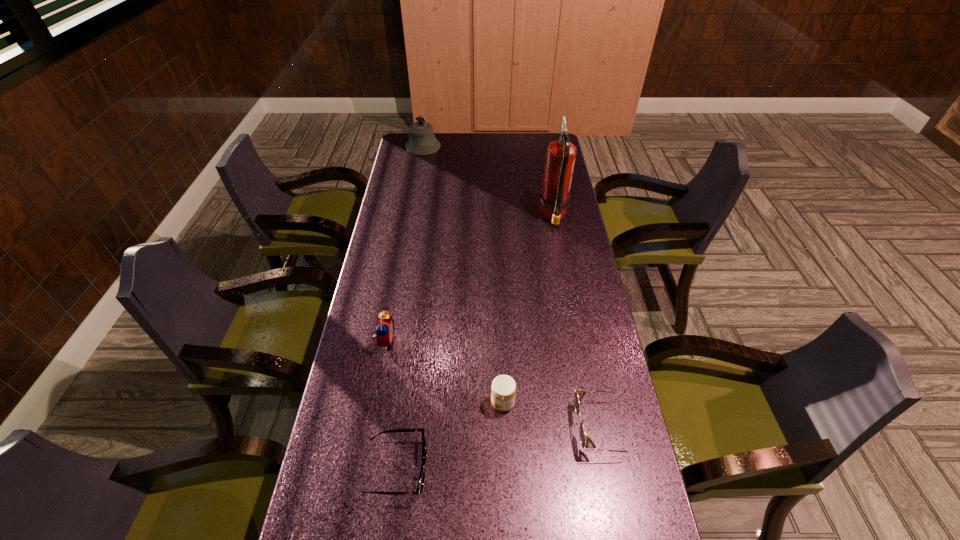
Where is `the tallest object`? The image size is (960, 540). the tallest object is located at coordinates (560, 155).

At what (x,y) coordinates should I click in order to perform the action: click on the second farthest object. Please return your answer as a coordinate pair (x, y). The image size is (960, 540). Looking at the image, I should click on pyautogui.click(x=560, y=155).

Locate an element on the screen. This screenshot has width=960, height=540. the fifth shortest object is located at coordinates (422, 141).

This screenshot has width=960, height=540. What are the coordinates of `bell` in the screenshot? It's located at (422, 141).

At what (x,y) coordinates should I click in order to perform the action: click on alarm clock. Please return your answer as a coordinate pair (x, y). The width and height of the screenshot is (960, 540). Looking at the image, I should click on (385, 329).

Identify the location of the fourth nearest object. (385, 329).

Locate an element on the screen. the third object from right to left is located at coordinates [x=503, y=389].

Find the location of a particular element. The height and width of the screenshot is (540, 960). the fifth tallest object is located at coordinates (579, 394).

Locate an element on the screen. the taller sunglasses is located at coordinates (579, 394).

What are the coordinates of `the shortest object` in the screenshot? It's located at (420, 485).